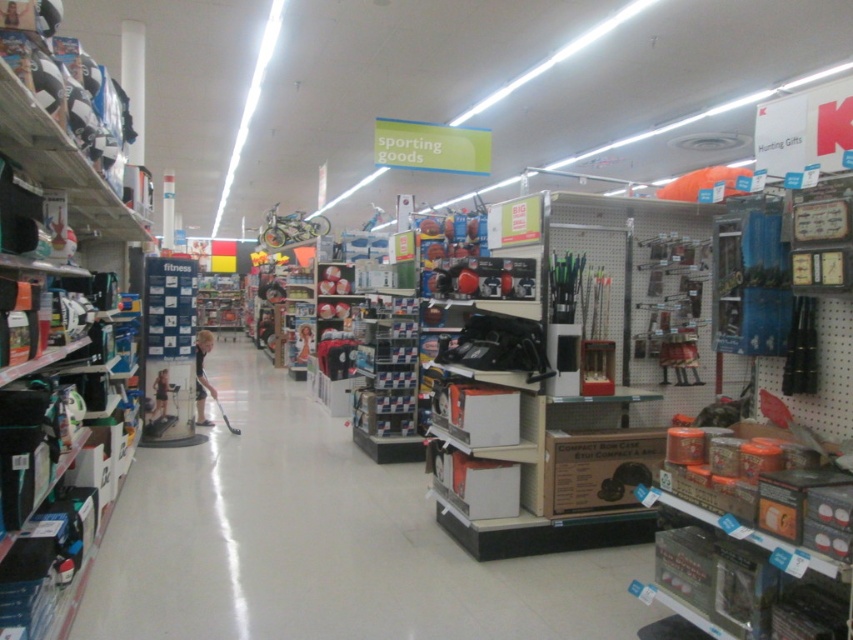
Question: Is matte black hockey stick at center smaller than dark blue shirt at center?

Choices:
 (A) no
 (B) yes

Answer: (B)

Question: Among these points, which one is farthest from the camera?

Choices:
 (A) (398, 557)
 (B) (90, 86)
 (C) (209, 387)

Answer: (C)

Question: Does matte black hockey stick at center have a lesser width compared to dark blue shirt at center?

Choices:
 (A) no
 (B) yes

Answer: (A)

Question: Estimate the real-world distances between objects in this image. Which object is closer to the matte black hockey stick at center?

Choices:
 (A) white plastic shelves at left
 (B) dark blue shirt at center

Answer: (B)

Question: Observing the image, what is the correct spatial positioning of white plastic shelves at left in reference to dark blue shirt at center?

Choices:
 (A) above
 (B) below

Answer: (A)

Question: Which of the following is the farthest from the observer?

Choices:
 (A) (33, 125)
 (B) (267, 465)

Answer: (B)